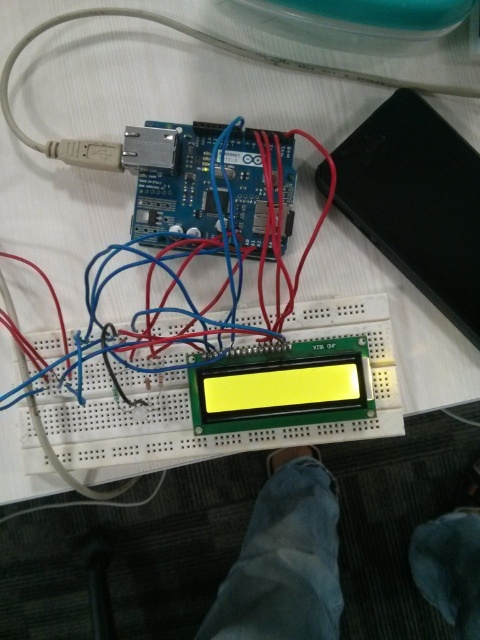
Question: Which of the following is the farthest from the observer?

Choices:
 (A) (252, 513)
 (B) (73, 145)

Answer: (A)

Question: Does jeans at lower center appear on the left side of white plastic usb cable connector at upper left?

Choices:
 (A) no
 (B) yes

Answer: (A)

Question: Which point appears farthest from the camera in this image?

Choices:
 (A) (117, 154)
 (B) (316, 470)

Answer: (B)

Question: Which point is closer to the camera?

Choices:
 (A) click(244, 580)
 (B) click(72, 141)

Answer: (B)

Question: From the image, what is the correct spatial relationship of jeans at lower center in relation to white plastic usb cable connector at upper left?

Choices:
 (A) left
 (B) right

Answer: (B)

Question: Is jeans at lower center further to camera compared to white plastic usb cable connector at upper left?

Choices:
 (A) no
 (B) yes

Answer: (A)